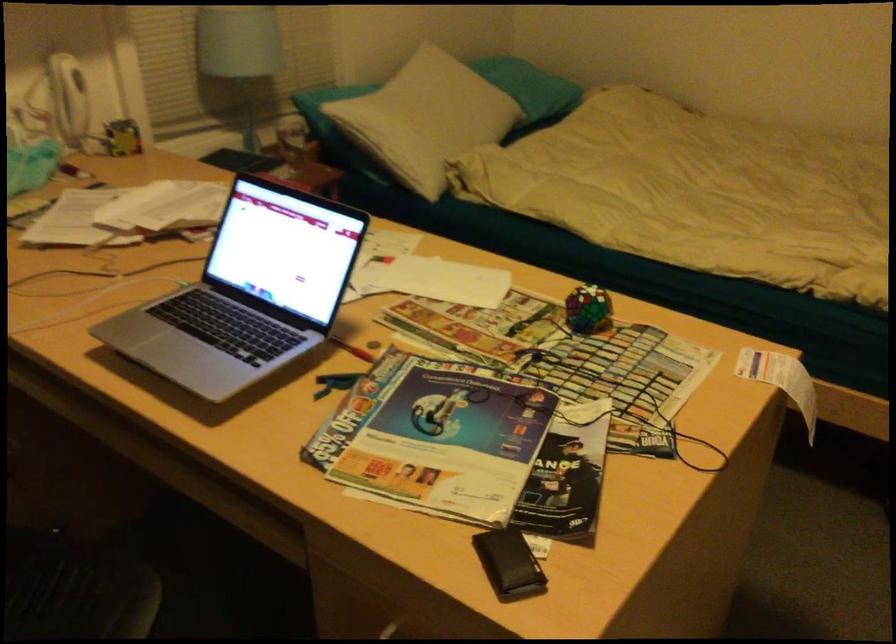
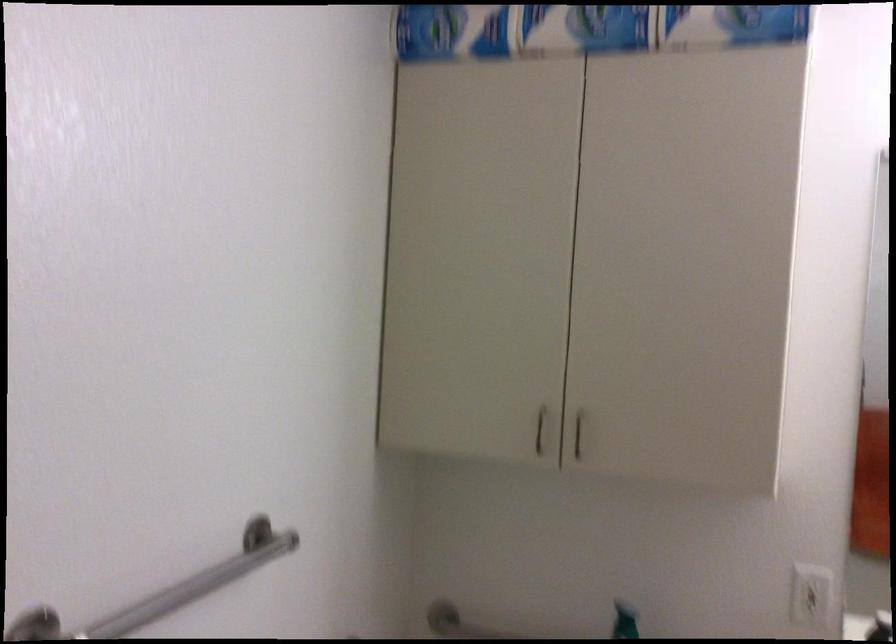
Question: The images are taken continuously from a first-person perspective. In which direction are you moving?

Choices:
 (A) Left
 (B) Right
 (C) Forward
 (D) Backward

Answer: (B)